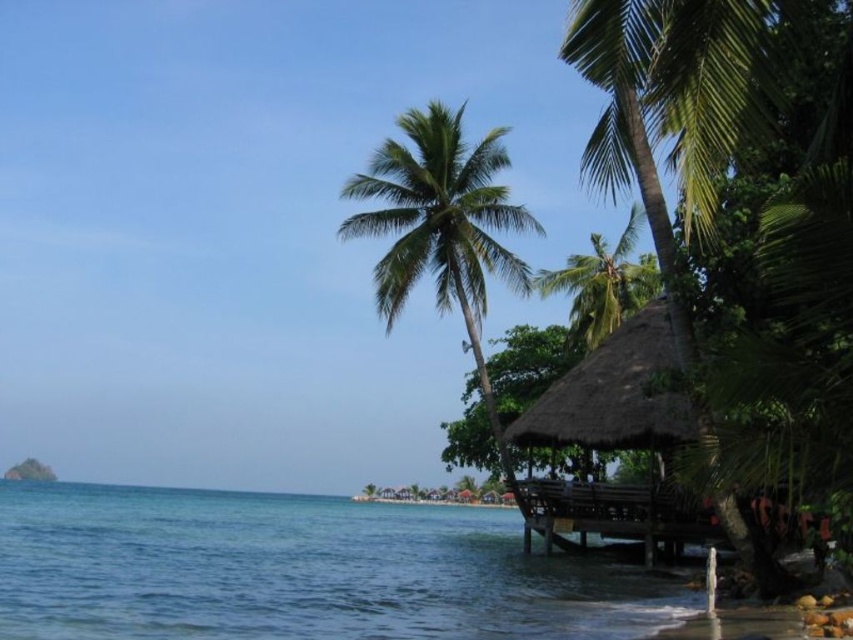
Is clear blue water at lower left thinner than green leafy palm tree at center?

In fact, clear blue water at lower left might be wider than green leafy palm tree at center.

How far apart are clear blue water at lower left and green leafy palm tree at center?

60.49 feet

Who is more distant from viewer, (480, 602) or (392, 150)?

Positioned behind is point (392, 150).

This screenshot has height=640, width=853. I want to click on clear blue water at lower left, so click(x=299, y=570).

Find the location of a particular element. This screenshot has height=640, width=853. green leafy palm tree at center is located at coordinates (444, 230).

Which is behind, point (490, 154) or point (612, 269)?

The point (612, 269) is behind.

I want to click on green leafy palm tree at center, so click(x=444, y=230).

Between clear blue water at lower left and green leafy palm tree at center-right, which one is positioned higher?

green leafy palm tree at center-right is higher up.

Locate an element on the screen. The height and width of the screenshot is (640, 853). clear blue water at lower left is located at coordinates (299, 570).